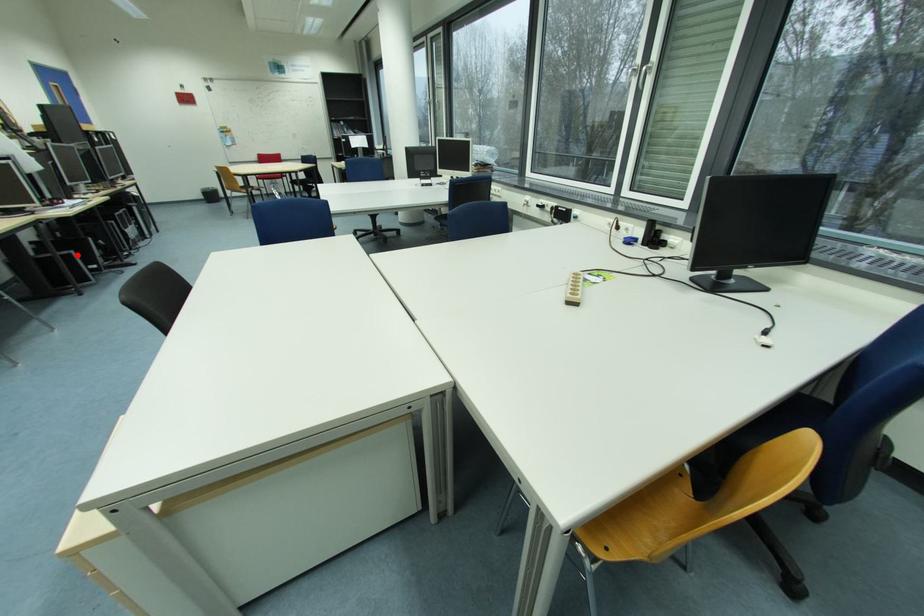
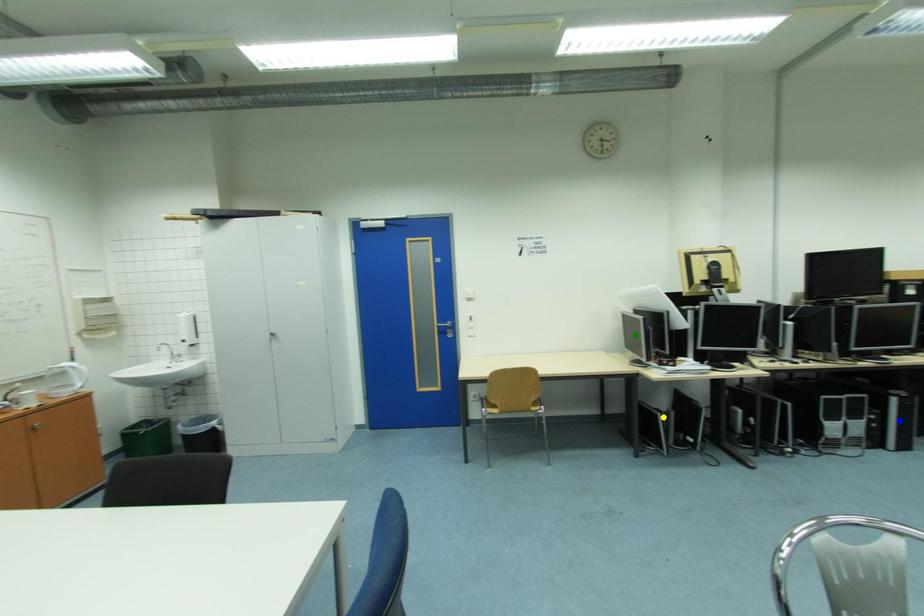
Question: I am providing you with two images of the same scene from different viewpoints. A red point is marked on the first image. You are given multiple points on the second image. In image 2, which mark is for the same physical point as the one in image 1?

Choices:
 (A) yellow point
 (B) blue point
 (C) green point

Answer: (A)